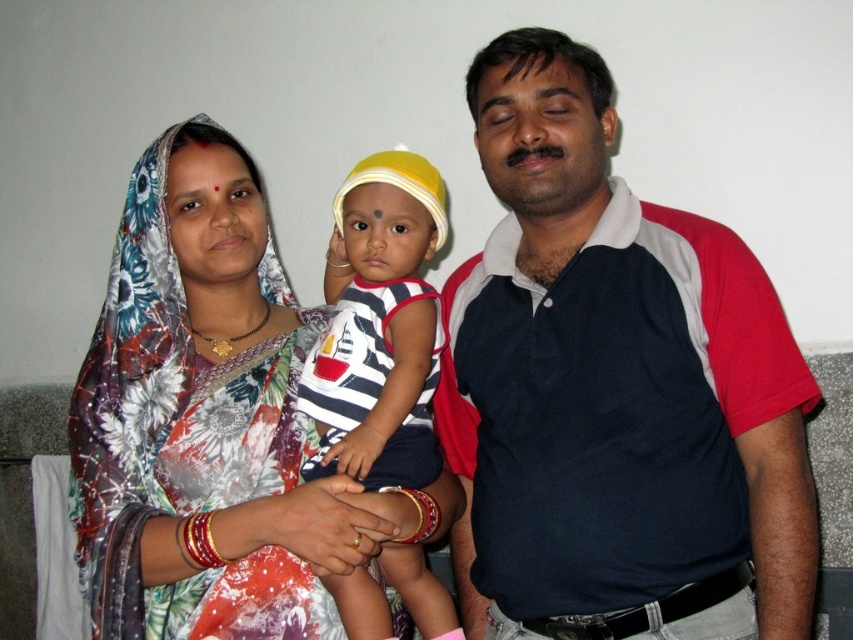
Question: Can you confirm if dark blue polo shirt at right is positioned to the right of striped fabric shirt at center?

Choices:
 (A) no
 (B) yes

Answer: (B)

Question: Which of the following is the farthest from the observer?

Choices:
 (A) striped fabric shirt at center
 (B) floral fabric saree at center

Answer: (A)

Question: Is dark blue polo shirt at right to the left of floral fabric saree at center from the viewer's perspective?

Choices:
 (A) yes
 (B) no

Answer: (B)

Question: Is dark blue polo shirt at right behind striped fabric shirt at center?

Choices:
 (A) yes
 (B) no

Answer: (B)

Question: Which object appears farthest from the camera in this image?

Choices:
 (A) striped fabric shirt at center
 (B) floral fabric saree at center

Answer: (A)

Question: Which object appears closest to the camera in this image?

Choices:
 (A) dark blue polo shirt at right
 (B) floral fabric saree at center

Answer: (A)